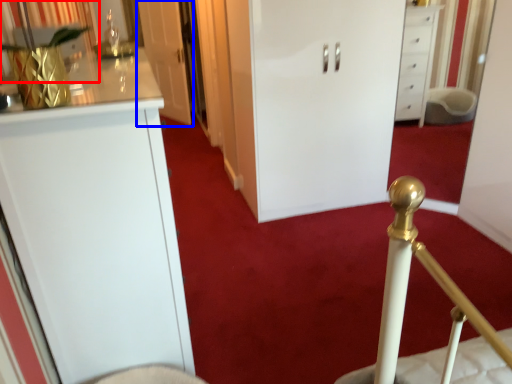
Question: Which point is further to the camera, curtain (highlighted by a red box) or door (highlighted by a blue box)?

Choices:
 (A) curtain
 (B) door

Answer: (B)